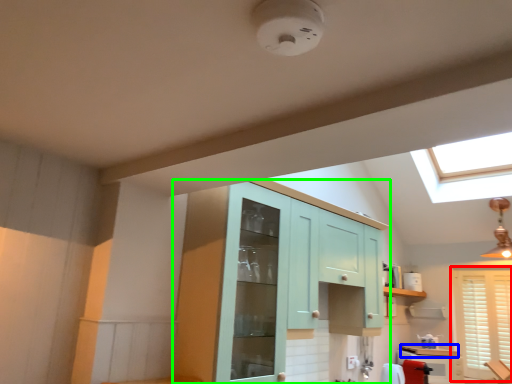
Question: Which object is the closest to the window (highlighted by a red box)? Choose among these: counter top (highlighted by a blue box) or cabinetry (highlighted by a green box).

Choices:
 (A) counter top
 (B) cabinetry

Answer: (A)